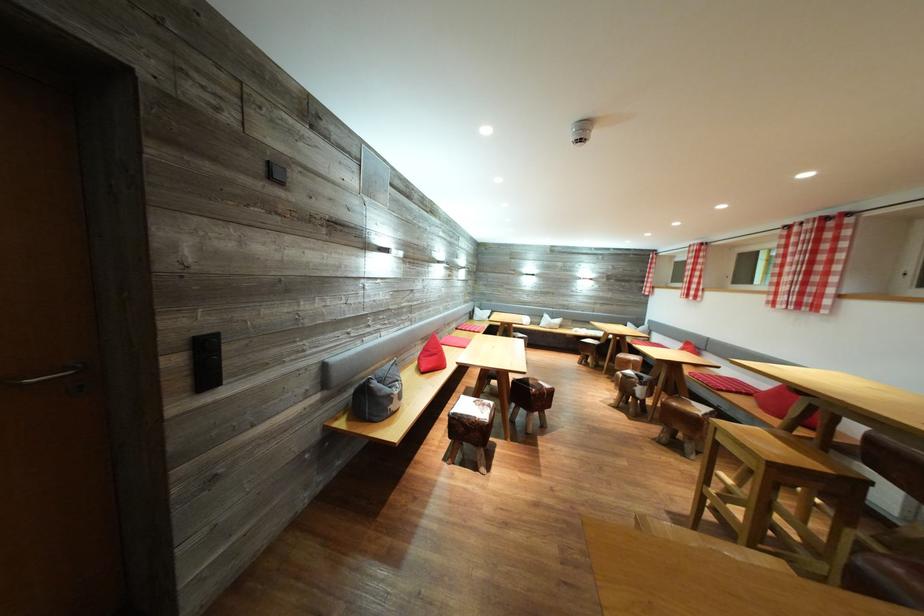
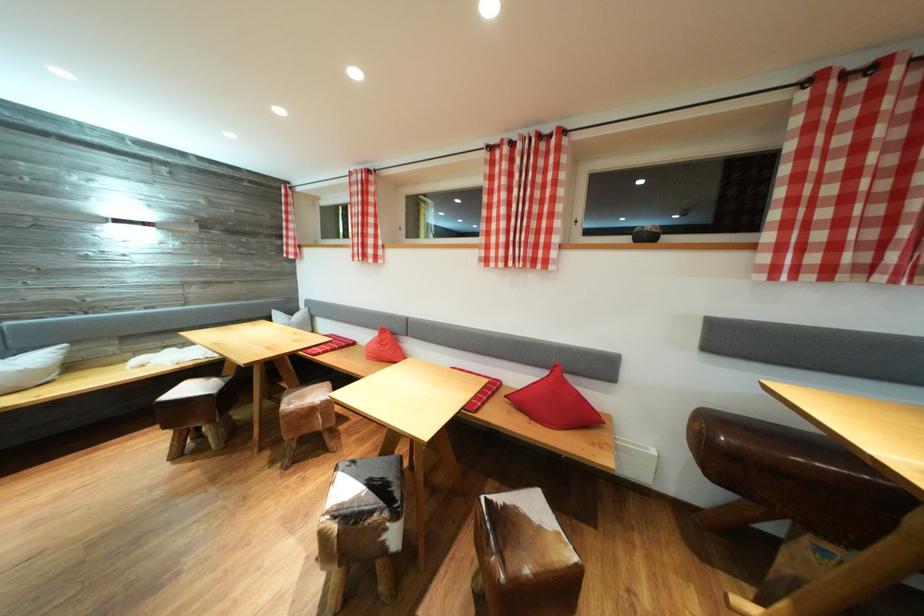
In the second image, find the point that corresponds to [593,362] in the first image.

(203, 434)